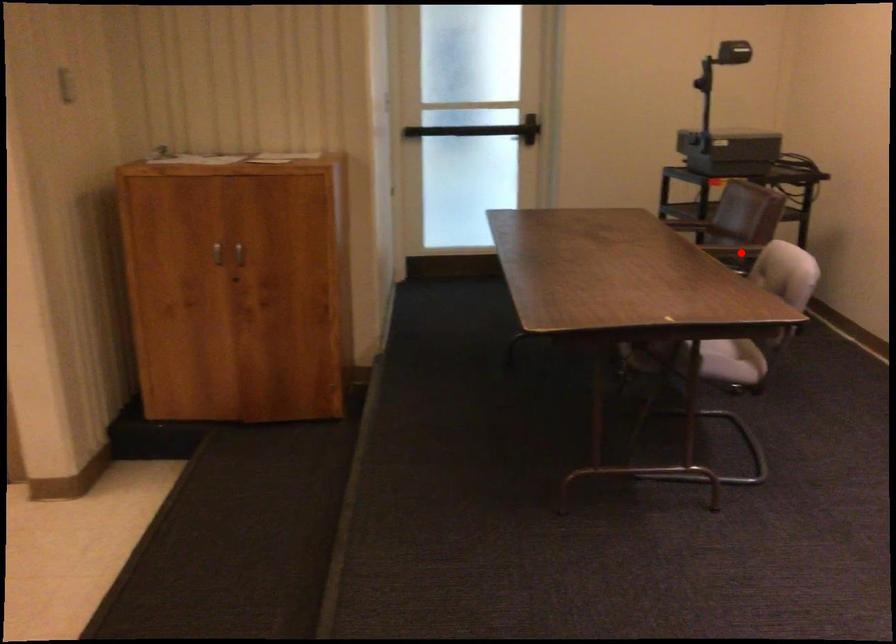
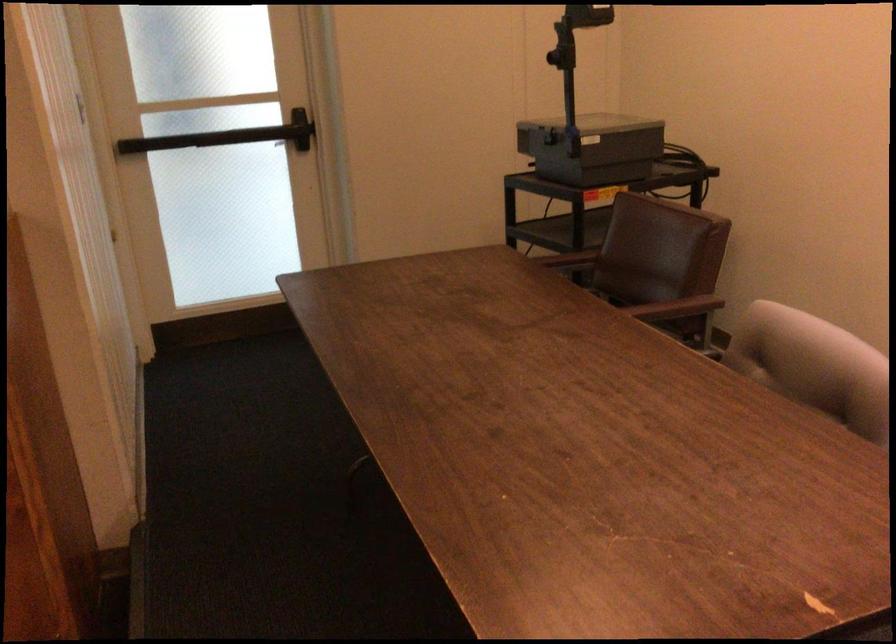
In the second image, find the point that corresponds to the highlighted location in the first image.

(677, 308)